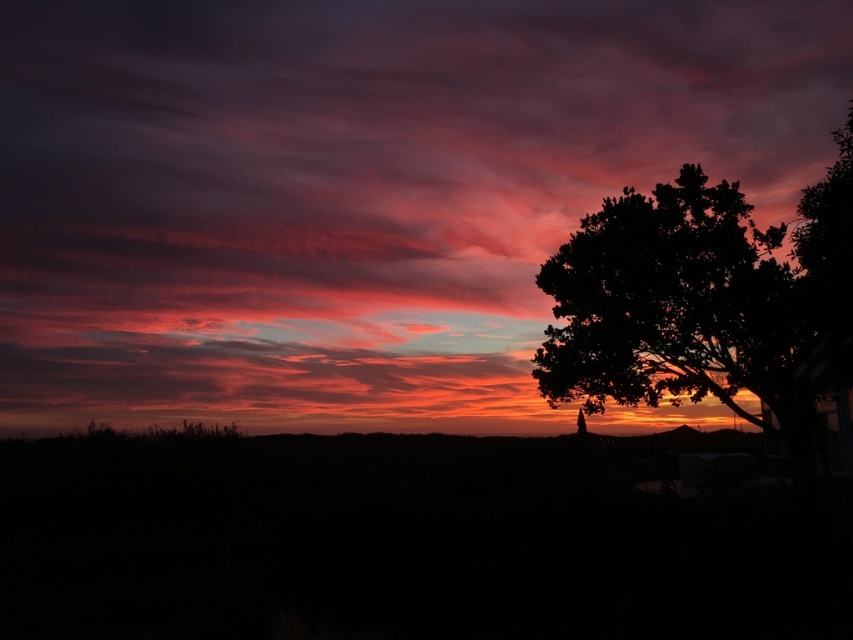
You are an astronomer observing the sunset scene. You notice two points in the image, one at coordinates point (161, 4) and the other at point (618, 371). Which point is closer to the horizon where the sun is setting?

Point (618, 371) is closer to the horizon where the sun is setting because it is in front of point (161, 4), which is behind it.

You are an artist trying to paint this sunset scene. You want to ensure the matte pink cloud at upper center and the silhouette tree at right are proportionally accurate. Which object should you draw wider?

The matte pink cloud at upper center should be drawn wider because its width is larger than the silhouette tree at right.